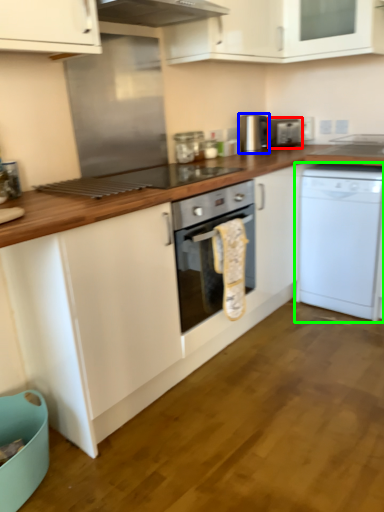
Question: Estimate the real-world distances between objects in this image. Which object is farther from appliance (highlighted by a red box), appliance (highlighted by a blue box) or dishwasher (highlighted by a green box)?

Choices:
 (A) appliance
 (B) dishwasher

Answer: (B)